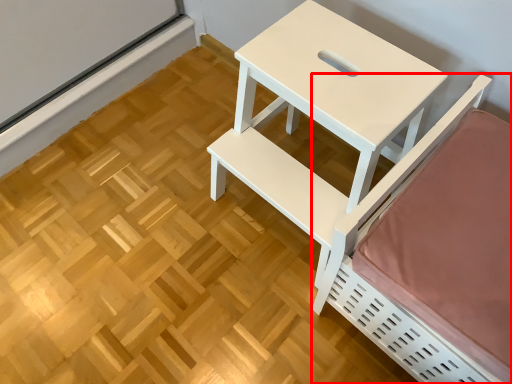
Question: Where is furniture (annotated by the red box) located in relation to table in the image?

Choices:
 (A) left
 (B) right

Answer: (B)